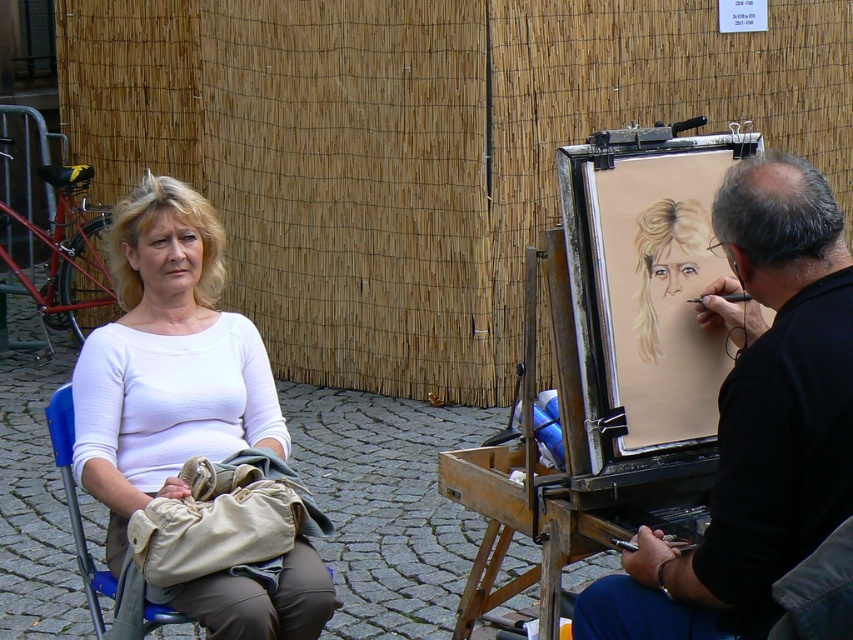
Consider the image. You are an artist who wants to set up a canvas for a new painting. You have a wooden easel at center and a blue plastic chair at lower left. Which object should you use to hold your canvas?

The wooden easel at center has a larger size compared to the blue plastic chair at lower left, so you should use the wooden easel at center to hold your canvas because it is designed for supporting larger canvases.

You are standing in the outdoor scene and want to take a photo of the wooden easel at center and the smooth black shirt at right. Which object should you focus on first if you want to capture both in the same frame without moving the camera?

The wooden easel at center is located below the smooth black shirt at right, so you should focus on the smooth black shirt at right first to ensure both are in the frame.